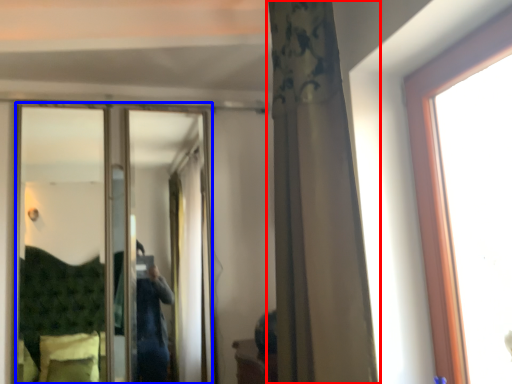
Question: Which of the following is the closest to the observer, curtain (highlighted by a red box) or mirror (highlighted by a blue box)?

Choices:
 (A) curtain
 (B) mirror

Answer: (A)